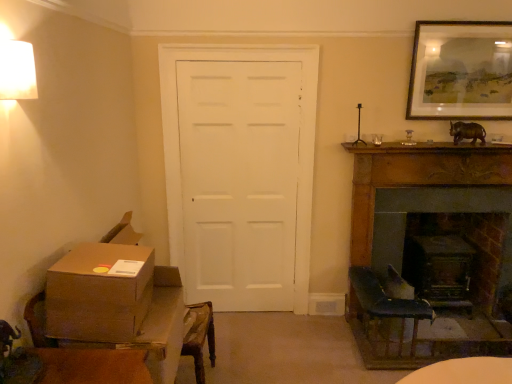
Question: From the image's perspective, is brown cardboard box at lower left located above or below wooden framed artwork at upper right?

Choices:
 (A) below
 (B) above

Answer: (A)

Question: Is brown cardboard box at lower left wider or thinner than wooden framed artwork at upper right?

Choices:
 (A) wide
 (B) thin

Answer: (A)

Question: Based on their relative distances, which object is farther from the brown cardboard box at lower left?

Choices:
 (A) dark wood fireplace at right, placed as the 1th fireplace when sorted from front to back
 (B) wooden framed artwork at upper right
 (C) white matte door at center
 (D) brown cardboard box at lower left
 (E) dark wood fireplace at right, which is counted as the 2th fireplace, starting from the front

Answer: (B)

Question: Estimate the real-world distances between objects in this image. Which object is closer to the brown cardboard box at lower left?

Choices:
 (A) brown cardboard box at lower left
 (B) dark wood fireplace at right, the 2th fireplace from the back
 (C) wooden framed artwork at upper right
 (D) white matte door at center
 (E) dark wood fireplace at right, which is counted as the 2th fireplace, starting from the front

Answer: (A)